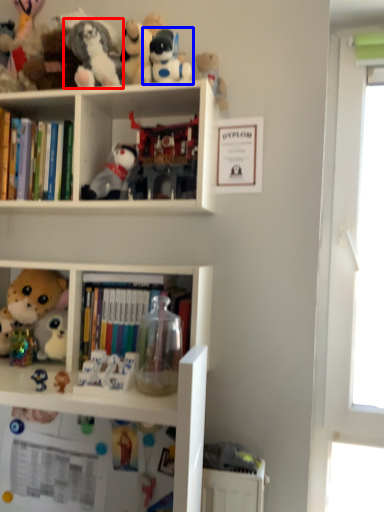
Question: Which object is further to the camera taking this photo, toy (highlighted by a red box) or toy (highlighted by a blue box)?

Choices:
 (A) toy
 (B) toy

Answer: (B)